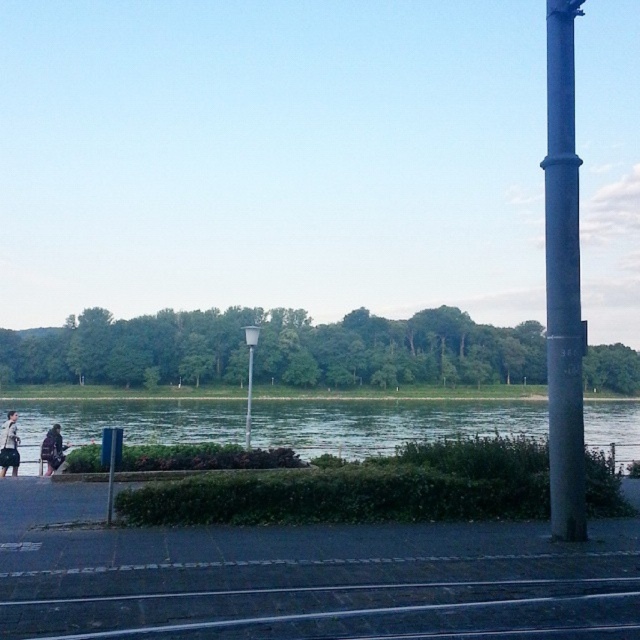
You are a gardener planning to mow the green grass at lower center and trim the metallic gray streetlight at center. Which object requires more horizontal space to work around?

The green grass at lower center requires more horizontal space to work around because its width surpasses that of the metallic gray streetlight at center.